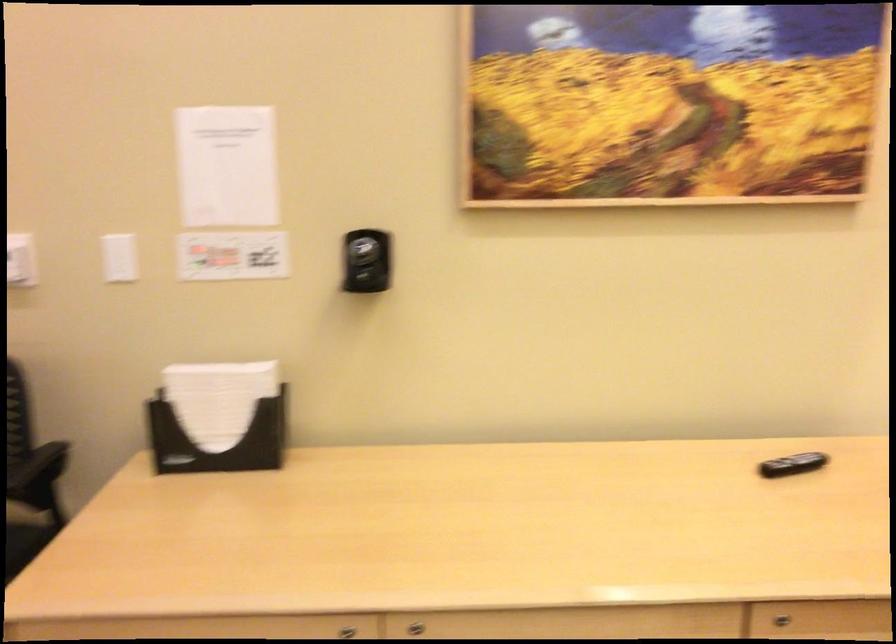
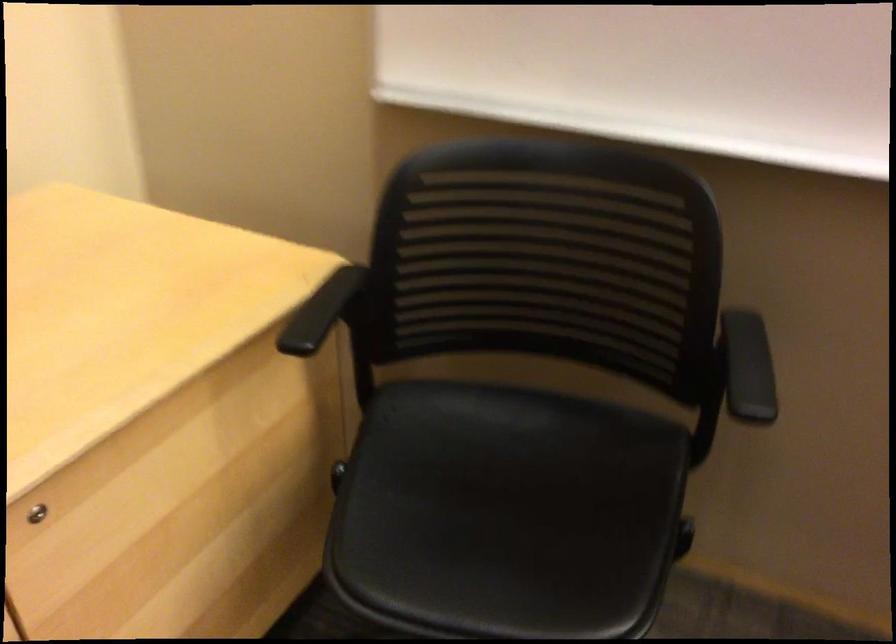
First-person continuous shooting, in which direction is the camera rotating?

The camera's rotation is toward right-down.